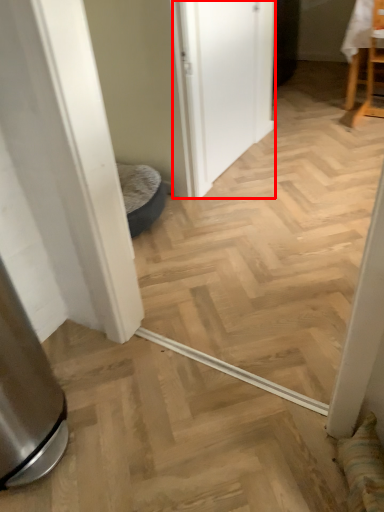
Question: From the image's perspective, where is screen door (annotated by the red box) located in relation to chair in the image?

Choices:
 (A) above
 (B) below

Answer: (B)